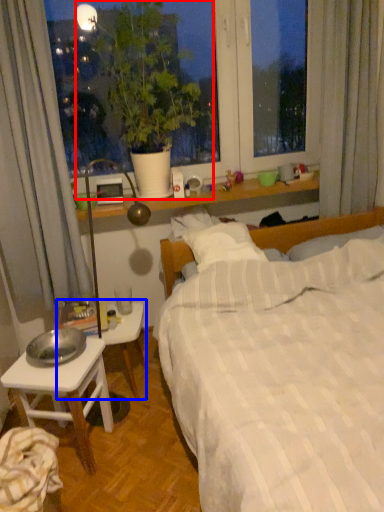
Question: Which object is further to the camera taking this photo, houseplant (highlighted by a red box) or table (highlighted by a blue box)?

Choices:
 (A) houseplant
 (B) table

Answer: (B)